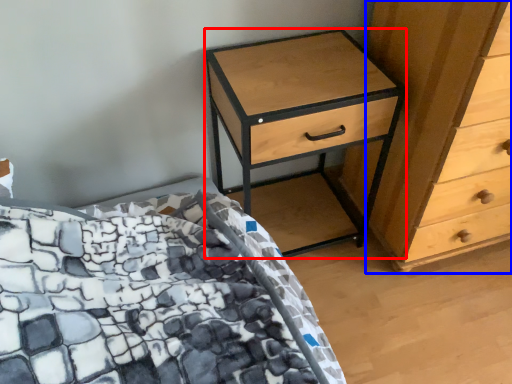
Question: Which of the following is the closest to the observer, nightstand (highlighted by a red box) or chest of drawers (highlighted by a blue box)?

Choices:
 (A) nightstand
 (B) chest of drawers

Answer: (B)